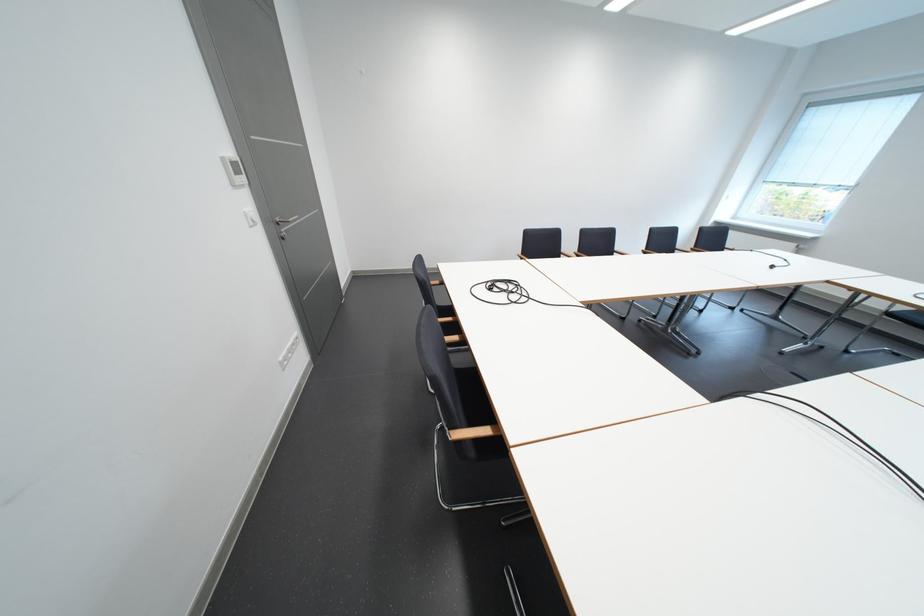
Where would you turn the metal door handle? Please return your answer as a coordinate pair (x, y).

(284, 224)